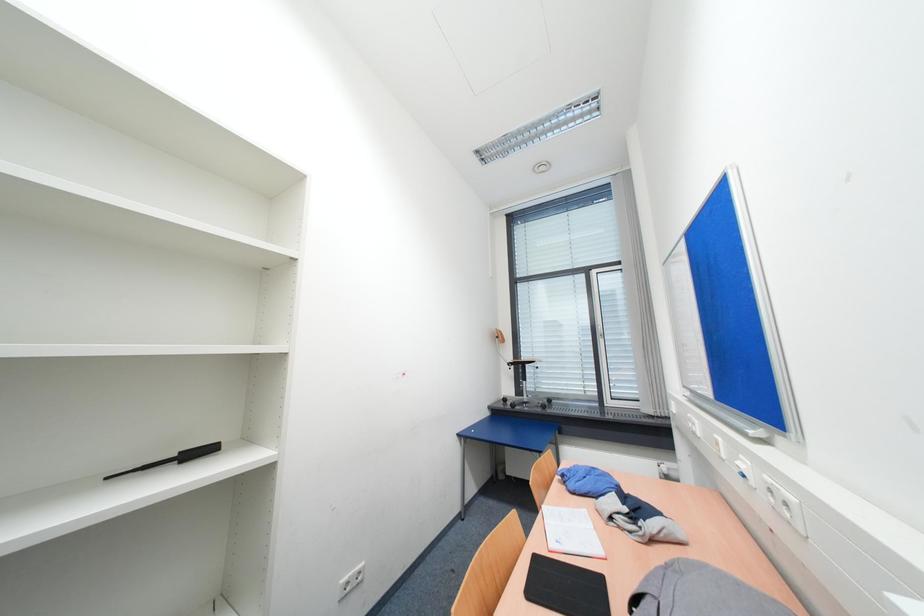
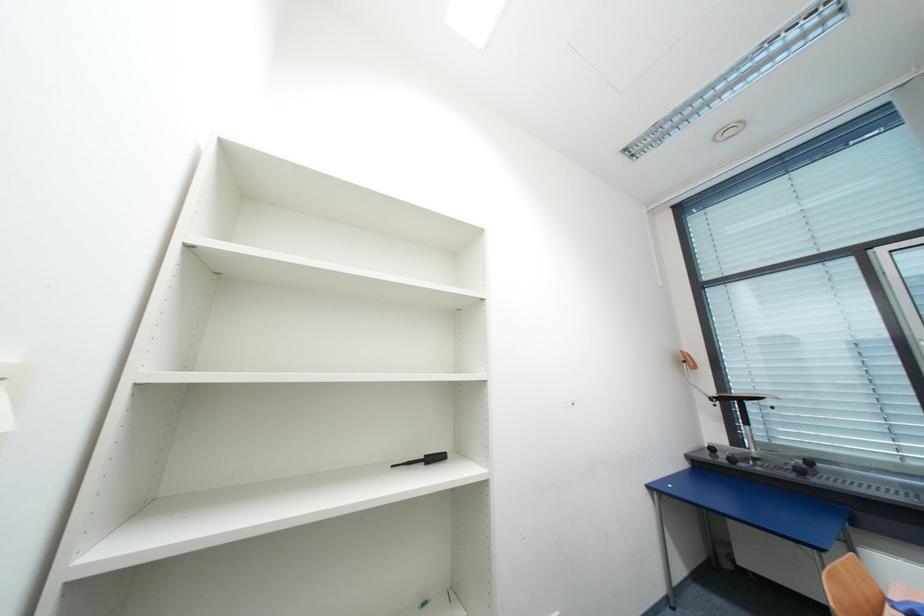
Question: Based on the continuous images, in which direction is the camera rotating? Reply with the corresponding letter.

Choices:
 (A) Left
 (B) Right
 (C) Up
 (D) Down

Answer: (A)